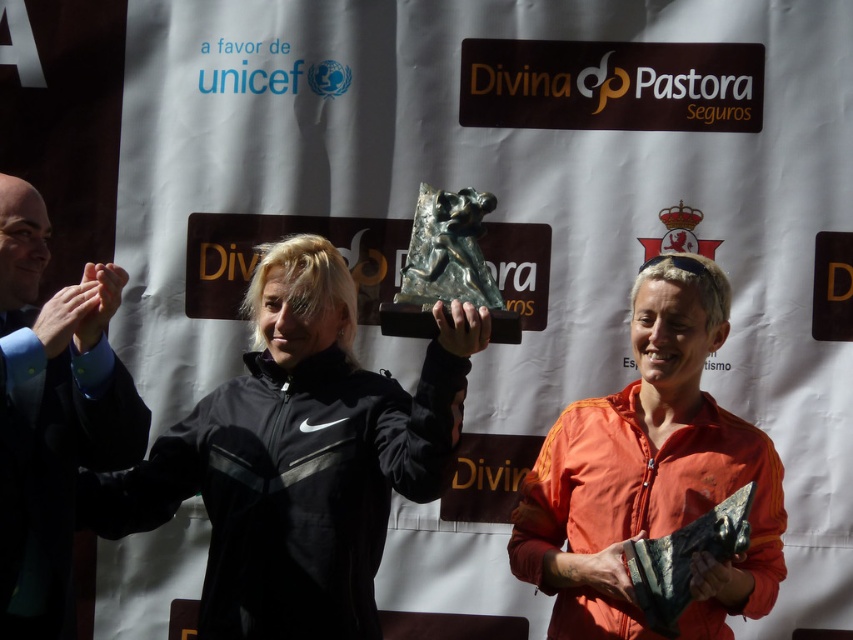
Which of these two, black matte jacket at center or orange matte jacket at center, stands taller?

Standing taller between the two is black matte jacket at center.

Between black matte jacket at center and orange matte jacket at center, which one appears on the left side from the viewer's perspective?

Positioned to the left is black matte jacket at center.

Looking at this image, who is more forward, (397, 424) or (637, 292)?

Positioned in front is point (397, 424).

Where is `black matte jacket at center`? black matte jacket at center is located at coordinates coord(299,458).

Does black matte jacket at center appear under dark blue suit at left?

Correct, black matte jacket at center is located below dark blue suit at left.

Who is more distant from viewer, [267,451] or [1,516]?

Positioned behind is point [267,451].

Image resolution: width=853 pixels, height=640 pixels. I want to click on black matte jacket at center, so click(299, 458).

Between orange matte jacket at center and dark blue suit at left, which one appears on the left side from the viewer's perspective?

dark blue suit at left

Consider the image. Is orange matte jacket at center below dark blue suit at left?

Result: Yes, orange matte jacket at center is below dark blue suit at left.

Does point (601, 449) lie in front of point (97, 275)?

No.

This screenshot has width=853, height=640. Find the location of `orange matte jacket at center`. orange matte jacket at center is located at coordinates (651, 474).